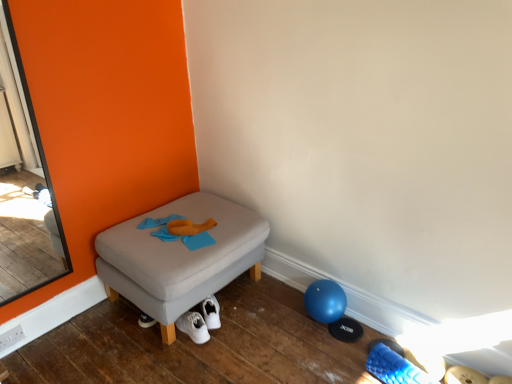
Question: Does clear glass screen door at left have a greater height compared to matte gray ottoman at center?

Choices:
 (A) no
 (B) yes

Answer: (B)

Question: Could you tell me if clear glass screen door at left is facing matte gray ottoman at center?

Choices:
 (A) no
 (B) yes

Answer: (A)

Question: Is clear glass screen door at left behind matte gray ottoman at center?

Choices:
 (A) no
 (B) yes

Answer: (A)

Question: Are clear glass screen door at left and matte gray ottoman at center far apart?

Choices:
 (A) no
 (B) yes

Answer: (A)

Question: Considering the relative sizes of clear glass screen door at left and matte gray ottoman at center in the image provided, is clear glass screen door at left shorter than matte gray ottoman at center?

Choices:
 (A) no
 (B) yes

Answer: (A)

Question: From a real-world perspective, does clear glass screen door at left sit lower than matte gray ottoman at center?

Choices:
 (A) no
 (B) yes

Answer: (A)

Question: Does white fabric shoe at lower center come behind matte gray ottoman at center?

Choices:
 (A) yes
 (B) no

Answer: (B)

Question: Does white fabric shoe at lower center have a greater height compared to matte gray ottoman at center?

Choices:
 (A) no
 (B) yes

Answer: (A)

Question: Is white fabric shoe at lower center positioned before matte gray ottoman at center?

Choices:
 (A) no
 (B) yes

Answer: (B)

Question: Is white fabric shoe at lower center not inside matte gray ottoman at center?

Choices:
 (A) yes
 (B) no

Answer: (A)

Question: Is white fabric shoe at lower center shorter than matte gray ottoman at center?

Choices:
 (A) yes
 (B) no

Answer: (A)

Question: From the image's perspective, is white fabric shoe at lower center over matte gray ottoman at center?

Choices:
 (A) yes
 (B) no

Answer: (B)

Question: Considering the relative positions of white fabric shoe at lower center and clear glass screen door at left in the image provided, is white fabric shoe at lower center to the left of clear glass screen door at left from the viewer's perspective?

Choices:
 (A) yes
 (B) no

Answer: (B)